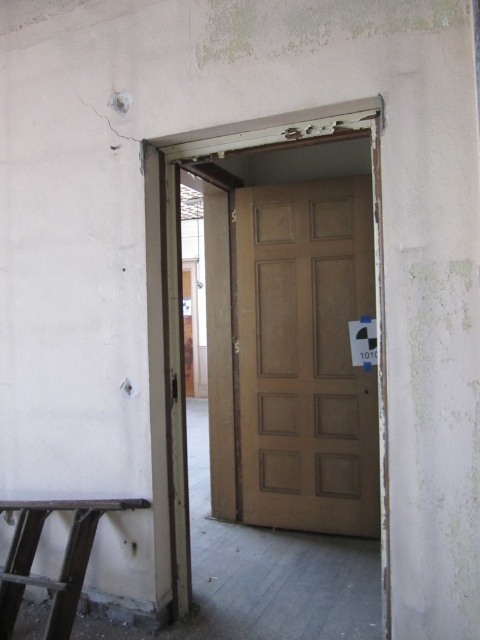
Question: Which of the following is the farthest from the observer?

Choices:
 (A) (280, 356)
 (B) (47, 508)

Answer: (A)

Question: Is matte brown door at center to the left of metallic stool at lower left from the viewer's perspective?

Choices:
 (A) no
 (B) yes

Answer: (A)

Question: Is matte brown door at center to the right of metallic stool at lower left from the viewer's perspective?

Choices:
 (A) yes
 (B) no

Answer: (A)

Question: Can you confirm if matte brown door at center is positioned below metallic stool at lower left?

Choices:
 (A) no
 (B) yes

Answer: (A)

Question: Among these points, which one is farthest from the camera?

Choices:
 (A) (348, 253)
 (B) (36, 516)

Answer: (A)

Question: Which point appears farthest from the camera in this image?

Choices:
 (A) coord(82,522)
 (B) coord(301,221)

Answer: (B)